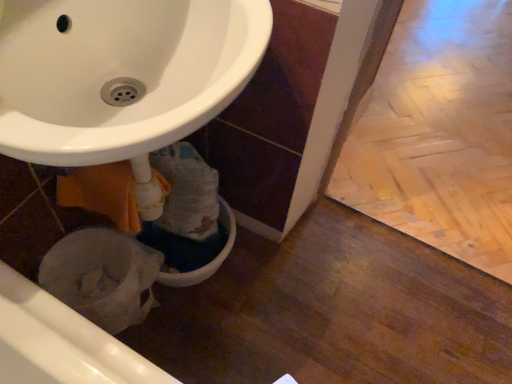
What do you see at coordinates (102, 276) in the screenshot? The image size is (512, 384). I see `white plastic bidet at lower left` at bounding box center [102, 276].

This screenshot has width=512, height=384. Identify the location of white plastic bidet at lower left. (102, 276).

The image size is (512, 384). What do you see at coordinates (439, 133) in the screenshot?
I see `wooden parquet floor at lower right` at bounding box center [439, 133].

What is the approximate width of wooden parquet floor at lower right?

5.96 feet.

You are a GUI agent. You are given a task and a screenshot of the screen. Output one action in this format:
    pyautogui.click(x=<x>, y=<y>)
    Task: Click on the wooden parquet floor at lower right
    
    Given the screenshot: What is the action you would take?
    pyautogui.click(x=439, y=133)

I want to click on white plastic bidet at lower left, so click(102, 276).

Is wooden parquet floor at lower right to the left of white plastic bidet at lower left from the viewer's perspective?

Result: Incorrect, wooden parquet floor at lower right is not on the left side of white plastic bidet at lower left.

Is the position of wooden parquet floor at lower right more distant than that of white plastic bidet at lower left?

Yes, wooden parquet floor at lower right is behind white plastic bidet at lower left.

Which is less distant, (440,225) or (116,293)?

Point (440,225) appears to be farther away from the viewer than point (116,293).

From the image's perspective, relative to white plastic bidet at lower left, is wooden parquet floor at lower right above or below?

wooden parquet floor at lower right is above white plastic bidet at lower left.

From a real-world perspective, is wooden parquet floor at lower right above or below white plastic bidet at lower left?

From a real-world perspective, wooden parquet floor at lower right is physically below white plastic bidet at lower left.

Between wooden parquet floor at lower right and white plastic bidet at lower left, which one has larger width?

wooden parquet floor at lower right.

Who is taller, wooden parquet floor at lower right or white plastic bidet at lower left?

white plastic bidet at lower left.

Is wooden parquet floor at lower right bigger than white plastic bidet at lower left?

Indeed, wooden parquet floor at lower right has a larger size compared to white plastic bidet at lower left.

Is wooden parquet floor at lower right spatially inside white plastic bidet at lower left, or outside of it?

wooden parquet floor at lower right is spatially situated outside white plastic bidet at lower left.

Is wooden parquet floor at lower right next to white plastic bidet at lower left and touching it?

There is a gap between wooden parquet floor at lower right and white plastic bidet at lower left.

Does wooden parquet floor at lower right turn towards white plastic bidet at lower left?

Yes, wooden parquet floor at lower right is turned towards white plastic bidet at lower left.

How many degrees apart are the facing directions of wooden parquet floor at lower right and white plastic bidet at lower left?

91.9 degrees separate the facing orientations of wooden parquet floor at lower right and white plastic bidet at lower left.

The width and height of the screenshot is (512, 384). Find the location of `bidet on the left of wooden parquet floor at lower right`. bidet on the left of wooden parquet floor at lower right is located at coordinates (102, 276).

Which object is positioned more to the left, white plastic bidet at lower left or wooden parquet floor at lower right?

white plastic bidet at lower left.

Considering the relative positions of white plastic bidet at lower left and wooden parquet floor at lower right in the image provided, is white plastic bidet at lower left behind wooden parquet floor at lower right?

That is False.

Considering the points (97, 260) and (486, 160), which point is behind, point (97, 260) or point (486, 160)?

Point (486, 160)

From the image's perspective, who appears lower, white plastic bidet at lower left or wooden parquet floor at lower right?

white plastic bidet at lower left.

From a real-world perspective, between white plastic bidet at lower left and wooden parquet floor at lower right, who is vertically lower?

From a 3D spatial view, wooden parquet floor at lower right is below.

Between white plastic bidet at lower left and wooden parquet floor at lower right, which one has larger width?

With larger width is wooden parquet floor at lower right.

Is white plastic bidet at lower left taller than wooden parquet floor at lower right?

Yes, white plastic bidet at lower left is taller than wooden parquet floor at lower right.

Can you confirm if white plastic bidet at lower left is smaller than wooden parquet floor at lower right?

Yes.

Is white plastic bidet at lower left outside of wooden parquet floor at lower right?

Yes, white plastic bidet at lower left is not within wooden parquet floor at lower right.

Does white plastic bidet at lower left touch wooden parquet floor at lower right?

No, white plastic bidet at lower left is not in contact with wooden parquet floor at lower right.

Is white plastic bidet at lower left aimed at wooden parquet floor at lower right?

No, white plastic bidet at lower left is not aimed at wooden parquet floor at lower right.

Can you tell me how much white plastic bidet at lower left and wooden parquet floor at lower right differ in facing direction?

The angle between the facing direction of white plastic bidet at lower left and the facing direction of wooden parquet floor at lower right is 91.9 degrees.

At what (x,y) coordinates should I click in order to perform the action: click on bidet below the wooden parquet floor at lower right (from the image's perspective). Please return your answer as a coordinate pair (x, y). Looking at the image, I should click on (102, 276).

Find the location of a particular element. This screenshot has width=512, height=384. bidet positioned vertically above the wooden parquet floor at lower right (from a real-world perspective) is located at coordinates (102, 276).

At what (x,y) coordinates should I click in order to perform the action: click on tile on the right of white plastic bidet at lower left. Please return your answer as a coordinate pair (x, y). Looking at the image, I should click on (439, 133).